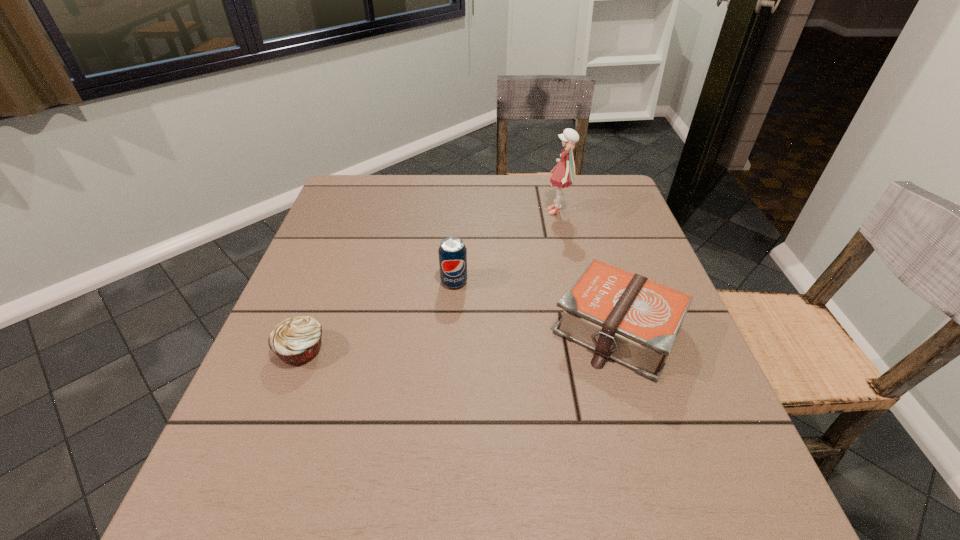
The width and height of the screenshot is (960, 540). I want to click on blank region between the shortest object and the farthest object, so click(430, 281).

Image resolution: width=960 pixels, height=540 pixels. Find the location of `vacant space in between the leftmost object and the second tallest object`. vacant space in between the leftmost object and the second tallest object is located at coordinates (378, 316).

The image size is (960, 540). I want to click on free space that is in between the leftmost object and the tallest object, so click(430, 281).

Image resolution: width=960 pixels, height=540 pixels. What are the coordinates of `blank region between the Bible and the soda can` in the screenshot? It's located at (536, 305).

At what (x,y) coordinates should I click in order to perform the action: click on the closest object to the farthest object. Please return your answer as a coordinate pair (x, y). The image size is (960, 540). Looking at the image, I should click on coord(634,321).

Identify which object is the second closest to the farthest object. Please provide its 2D coordinates. Your answer should be formatted as a tuple, i.e. [(x, y)], where the tuple contains the x and y coordinates of a point satisfying the conditions above.

[(452, 252)]

Identify the location of vacant region that satisfies the following two spatial constraints: 1. on the front-facing side of the farthest object; 2. on the left side of the Bible. The height and width of the screenshot is (540, 960). (586, 329).

At what (x,y) coordinates should I click in order to perform the action: click on free space in the image that satisfies the following two spatial constraints: 1. on the front-facing side of the Bible; 2. on the right side of the farthest object. Please return your answer as a coordinate pair (x, y). This screenshot has width=960, height=540. Looking at the image, I should click on (586, 329).

Locate an element on the screen. free space that satisfies the following two spatial constraints: 1. on the front-facing side of the doll; 2. on the back side of the Bible is located at coordinates (586, 329).

Find the location of `free spot that satisfies the following two spatial constraints: 1. on the front-facing side of the farthest object; 2. on the front side of the third shortest object`. free spot that satisfies the following two spatial constraints: 1. on the front-facing side of the farthest object; 2. on the front side of the third shortest object is located at coordinates (574, 282).